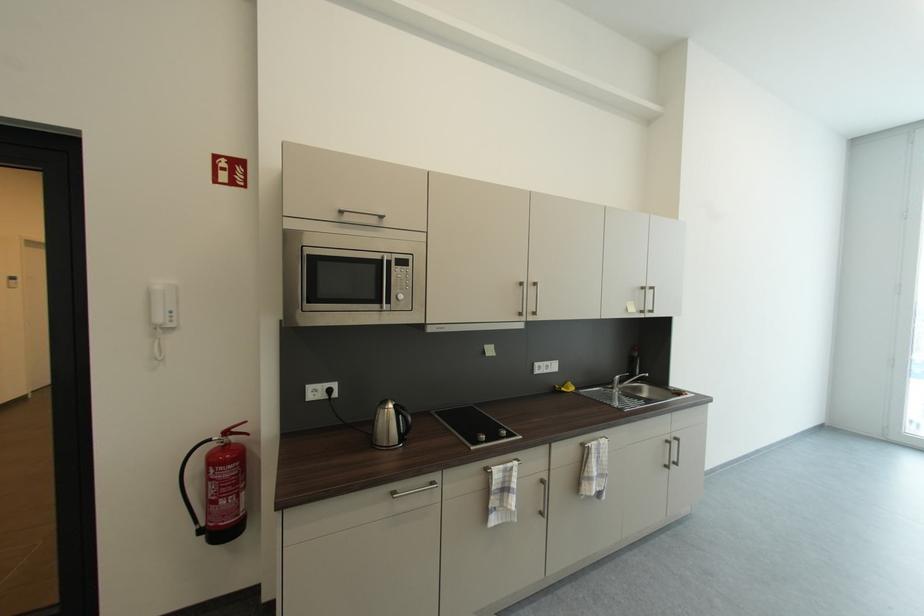
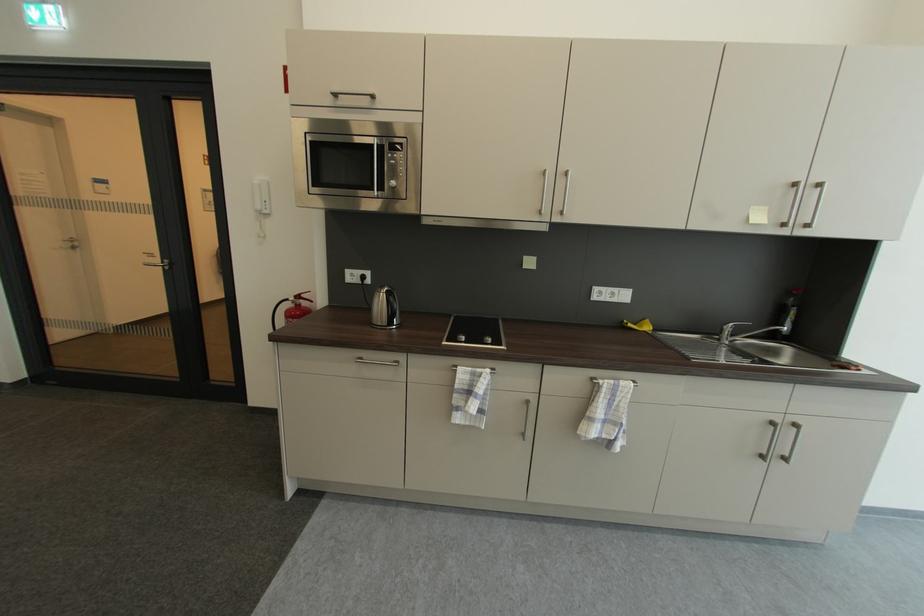
Locate, in the second image, the point that corresponds to the point at 617,387 in the first image.

(723, 339)